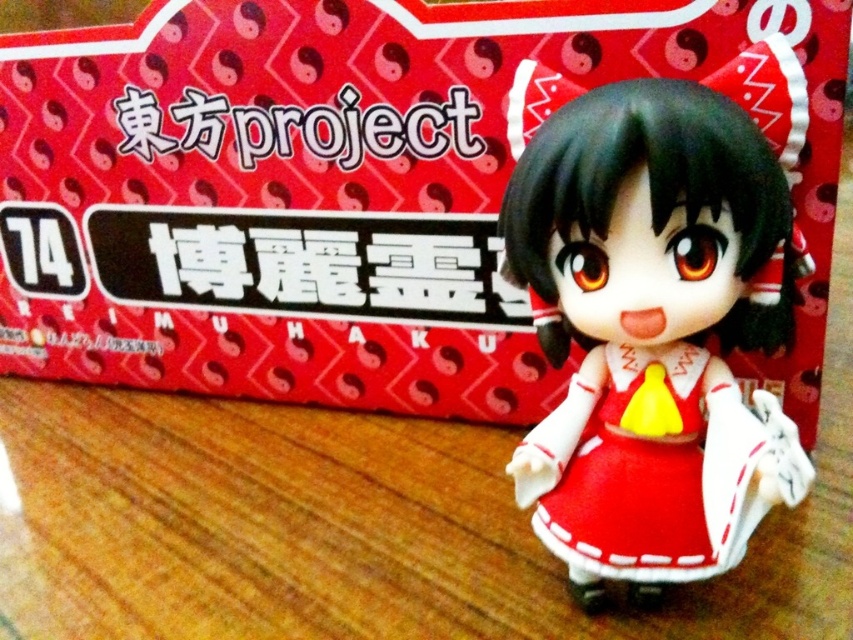
Question: Does matte plastic figurine at center come in front of matte red dress at center?

Choices:
 (A) no
 (B) yes

Answer: (B)

Question: Is matte red box at center above matte red dress at center?

Choices:
 (A) no
 (B) yes

Answer: (B)

Question: Which is nearer to the matte plastic figurine at center?

Choices:
 (A) matte red box at center
 (B) matte red dress at center

Answer: (B)

Question: Which of the following is the farthest from the observer?

Choices:
 (A) matte red dress at center
 (B) matte plastic figurine at center
 (C) matte red box at center

Answer: (C)

Question: Can you confirm if matte plastic figurine at center is positioned to the left of matte red dress at center?

Choices:
 (A) no
 (B) yes

Answer: (A)

Question: Which of the following is the closest to the observer?

Choices:
 (A) (396, 381)
 (B) (552, 515)
 (C) (677, 369)

Answer: (C)